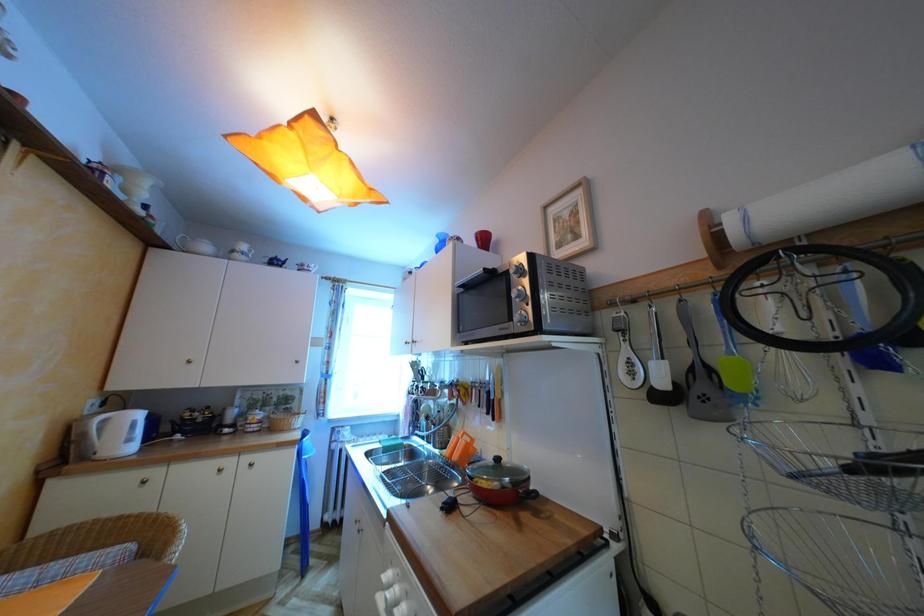
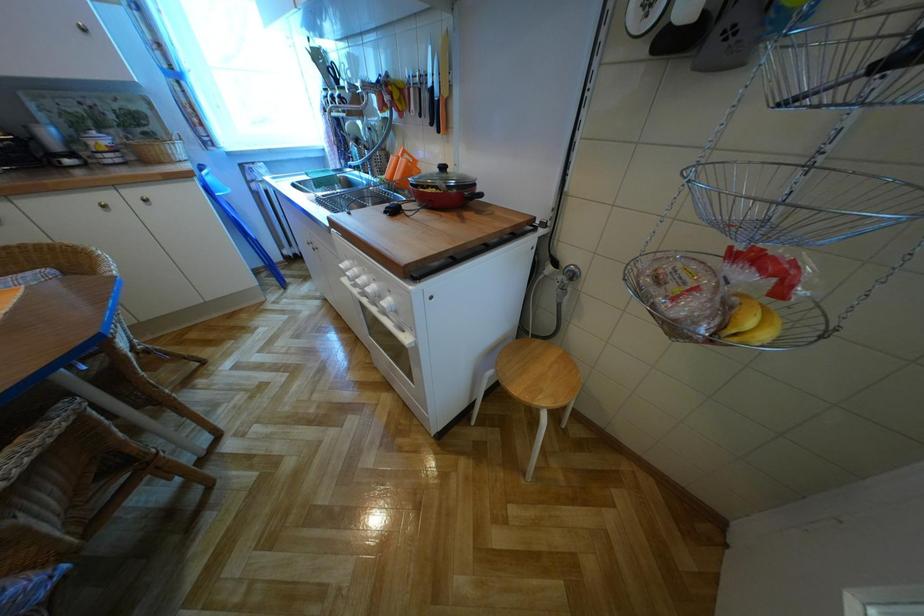
First-person continuous shooting, in which direction is the camera rotating?

The camera rotated toward right-down.